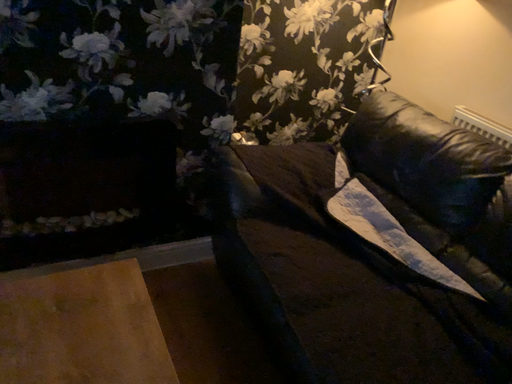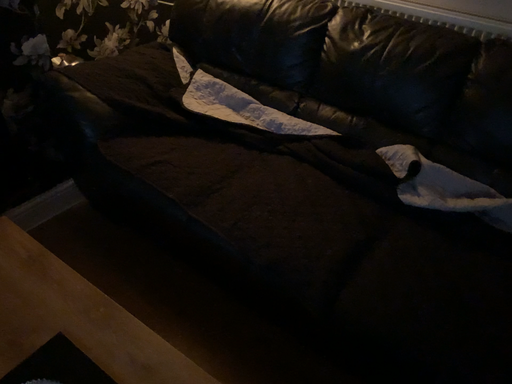
Question: Which way did the camera rotate in the video?

Choices:
 (A) rotated upward
 (B) rotated downward

Answer: (B)